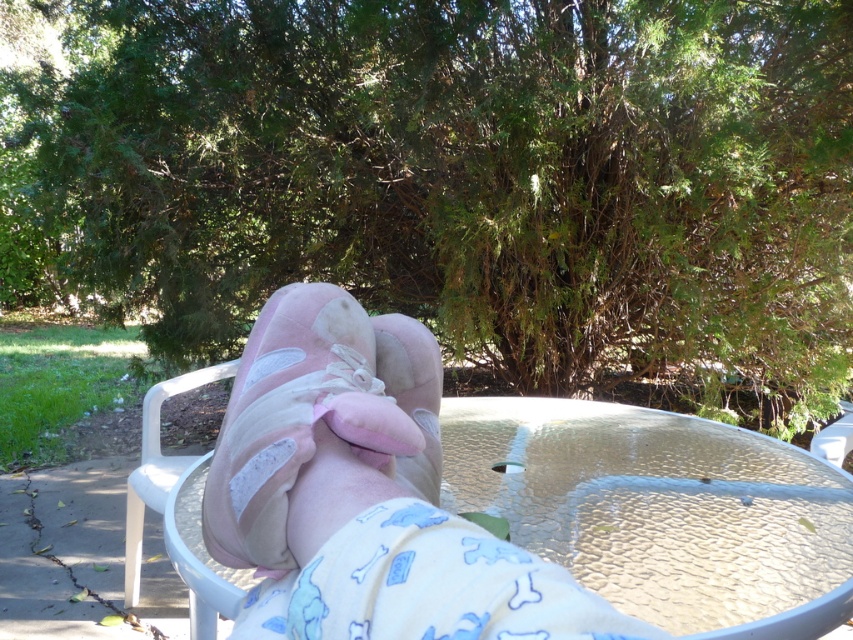
Based on the photo, you are standing in the outdoor area and want to reach the point marked as point (x=165, y=538). If your stride length is 28 inches, how many full strides will you need to take to reach it?

The point (x=165, y=538) is 30.93 inches away from the viewer. Since each stride is 28 inches, you would need 2 full strides to cover the distance, as 28 x 1.104 is approximately 30.93 inches. However, since you can only take full strides, you would need to take 2 full strides to reach or surpass the point.

Based on the photo, you are a delivery person who needs to place a package on the clear glass table at center without stepping on the pink suede slippers at center. How should you position the package?

The pink suede slippers at center are behind the clear glass table at center, so you should place the package on the clear glass table at center in front of the slippers to avoid stepping on them.

You are a delivery person trying to place a package on the clear glass table at center without disturbing the pink suede slippers at center. Is the table still accessible for placing the package?

The clear glass table at center is below the pink suede slippers at center, so the table is currently blocked by the slippers and not accessible for placing the package.